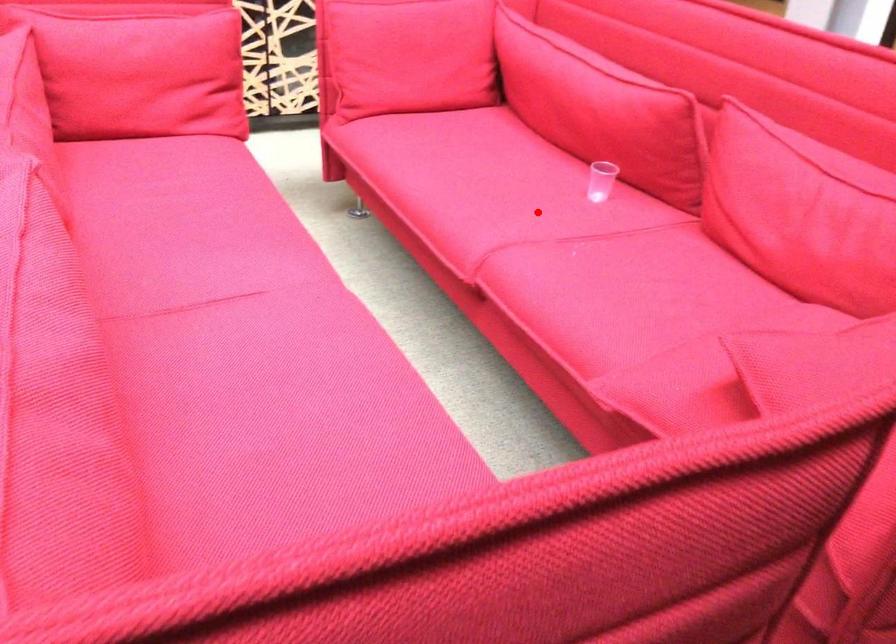
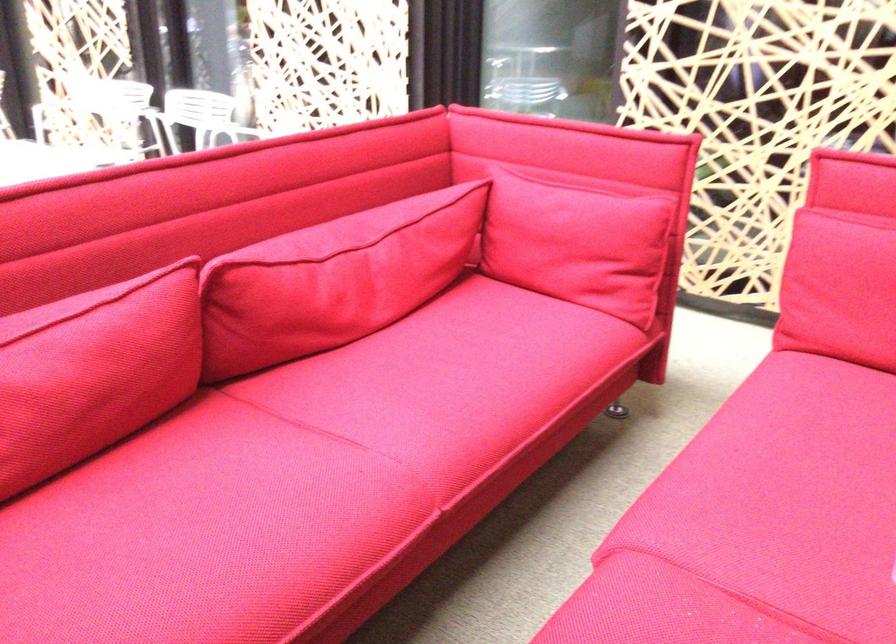
Question: I am providing you with two images of the same scene from different viewpoints. A red point is marked on the first image. Can you still see the location of the red point in image 2?

Choices:
 (A) Yes
 (B) No

Answer: (A)